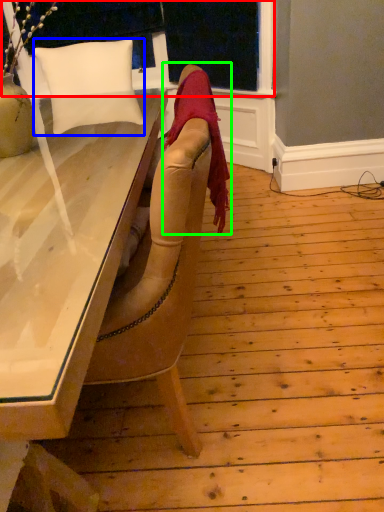
Question: Which is farther away from window frame (highlighted by a red box)? pillow (highlighted by a blue box) or blanket (highlighted by a green box)?

Choices:
 (A) pillow
 (B) blanket

Answer: (B)